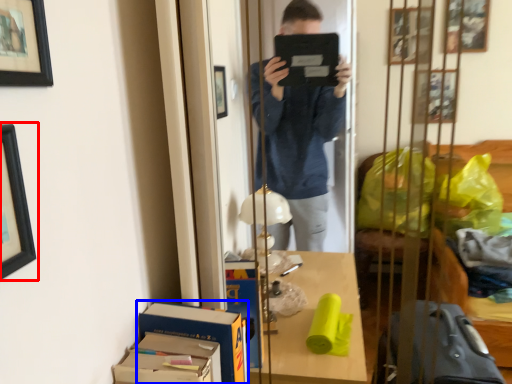
Question: Among these objects, which one is nearest to the camera, picture frame (highlighted by a red box) or cardboard box (highlighted by a blue box)?

Choices:
 (A) picture frame
 (B) cardboard box

Answer: (A)